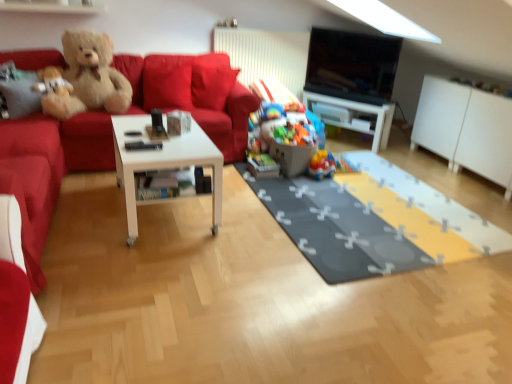
Where is `vacant area that is in front of translucent plastic toy at center, which is counted as the third toy, starting from the left`? This screenshot has width=512, height=384. vacant area that is in front of translucent plastic toy at center, which is counted as the third toy, starting from the left is located at coordinates (326, 180).